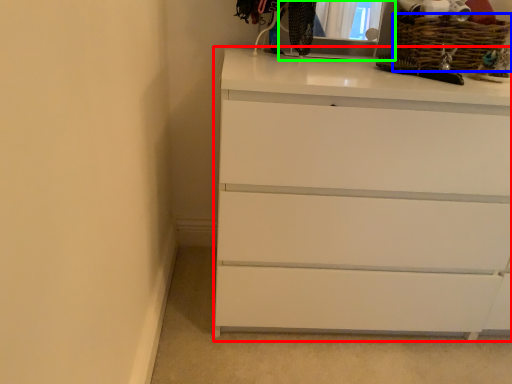
Question: Which object is the closest to the chest of drawers (highlighted by a red box)? Choose among these: basket (highlighted by a blue box) or medicine cabinet (highlighted by a green box).

Choices:
 (A) basket
 (B) medicine cabinet

Answer: (A)